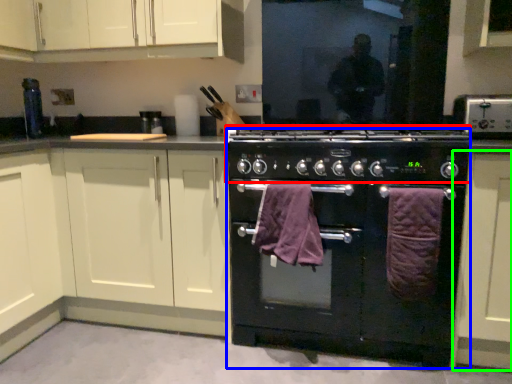
Question: Which is farther away from appliance (highlighted by a red box)? home appliance (highlighted by a blue box) or cabinetry (highlighted by a green box)?

Choices:
 (A) home appliance
 (B) cabinetry

Answer: (B)